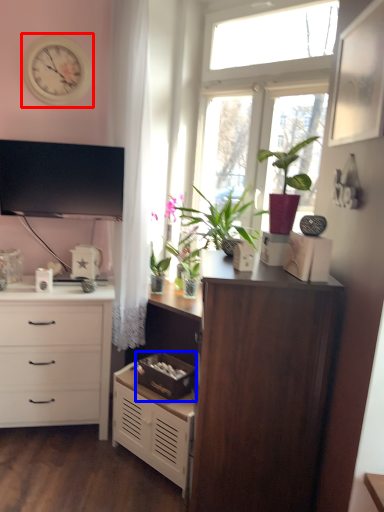
Question: Which point is further to the camera, clock (highlighted by a red box) or storage box (highlighted by a blue box)?

Choices:
 (A) clock
 (B) storage box

Answer: (A)